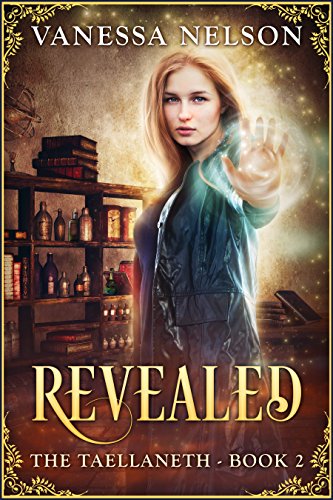
Where is `bottom book`? The height and width of the screenshot is (500, 333). bottom book is located at coordinates (73, 351).